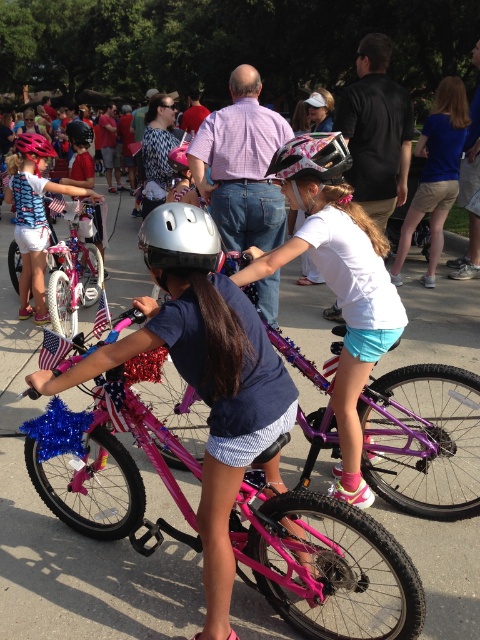
Question: Does pink metallic bicycle at center come in front of matte pink bicycle helmet at center?

Choices:
 (A) yes
 (B) no

Answer: (A)

Question: Is silver metallic helmet at center thinner than matte black helmet at upper center?

Choices:
 (A) no
 (B) yes

Answer: (B)

Question: Can you confirm if silver metallic helmet at center is positioned above shiny pink helmet at center?

Choices:
 (A) no
 (B) yes

Answer: (A)

Question: Which point is closer to the camera?

Choices:
 (A) (20, 288)
 (B) (108, 513)
 (C) (284, 176)
 (D) (81, 120)

Answer: (C)

Question: Which point is farther to the camera?

Choices:
 (A) matte pink bicycle helmet at center
 (B) shiny pink bicycle at left
 (C) shiny pink helmet at center

Answer: (C)

Question: Estimate the real-world distances between objects in this image. Which object is farther from the shiny pink helmet at center?

Choices:
 (A) silver metallic helmet at center
 (B) matte black helmet at upper center
 (C) shiny pink bicycle at left

Answer: (A)